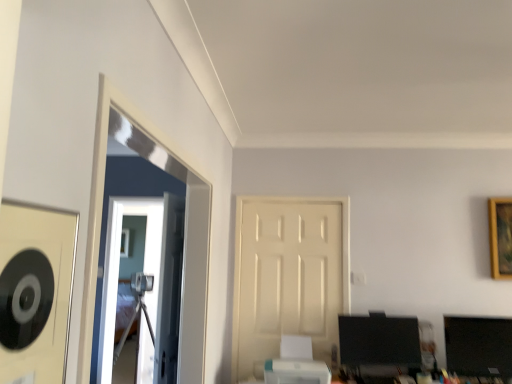
Question: Based on their sizes in the image, would you say white matte door at center is bigger or smaller than matte black monitor at lower right?

Choices:
 (A) small
 (B) big

Answer: (A)

Question: Considering their positions, is white matte door at center located in front of or behind matte black monitor at lower right?

Choices:
 (A) front
 (B) behind

Answer: (B)

Question: Estimate the real-world distances between objects in this image. Which object is closer to the matte black monitor at lower right?

Choices:
 (A) transparent glass door at center
 (B) white matte door at center
 (C) white plastic printer at lower center
 (D) gold wooden picture frame at upper right

Answer: (C)

Question: Based on their relative distances, which object is nearer to the transparent glass door at center?

Choices:
 (A) white plastic printer at lower center
 (B) white matte door at center
 (C) matte black monitor at lower right
 (D) gold wooden picture frame at upper right

Answer: (B)